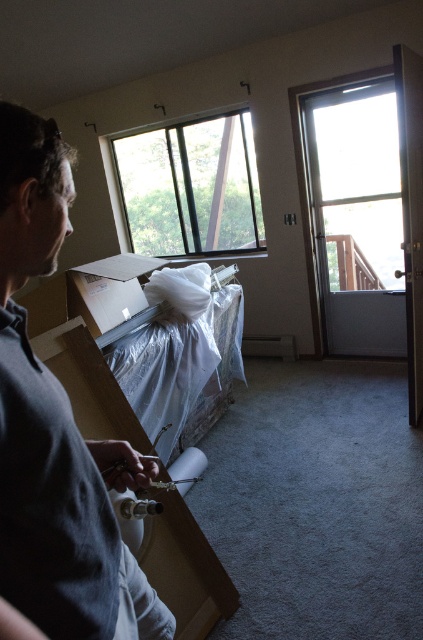
Question: Which of the following is the farthest from the observer?

Choices:
 (A) (209, 189)
 (B) (51, 352)

Answer: (A)

Question: Is matte brown cardboard box at left below cardboard box at center?

Choices:
 (A) no
 (B) yes

Answer: (B)

Question: Can you confirm if matte brown cardboard box at left is thinner than cardboard box at center?

Choices:
 (A) no
 (B) yes

Answer: (A)

Question: Is clear glass window at upper center further to the viewer compared to matte brown cardboard box at left?

Choices:
 (A) yes
 (B) no

Answer: (A)

Question: Which point is closer to the camera?

Choices:
 (A) (117, 317)
 (B) (164, 506)
 (C) (191, 221)

Answer: (B)

Question: Which point appears closest to the camera in this image?

Choices:
 (A) (120, 310)
 (B) (131, 442)
 (C) (250, 209)

Answer: (B)